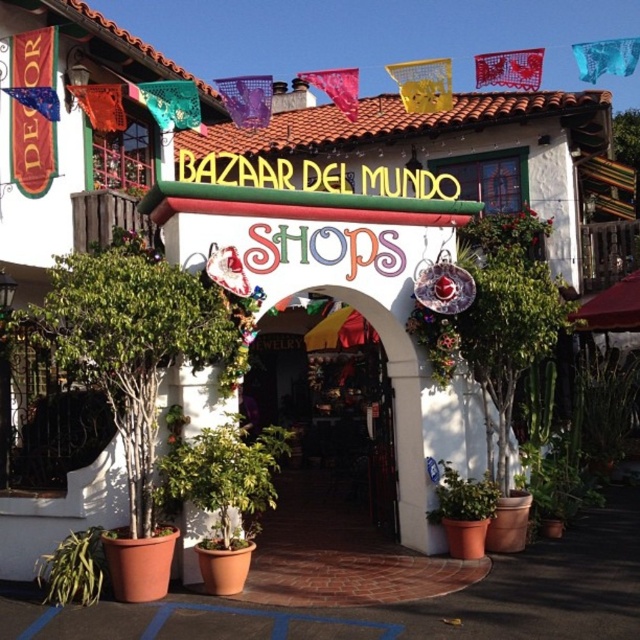
Question: Which point is closer to the camera?

Choices:
 (A) green matte plant at lower center
 (B) wooden door at center
 (C) green leafy plant at center

Answer: (C)

Question: Can you confirm if wooden door at center is smaller than green matte plant at lower center?

Choices:
 (A) no
 (B) yes

Answer: (A)

Question: Can you confirm if green matte plant at lower right is positioned below green matte plant at lower center?

Choices:
 (A) no
 (B) yes

Answer: (B)

Question: Which point is closer to the camera taking this photo?

Choices:
 (A) (456, 508)
 (B) (348, 346)

Answer: (A)

Question: Is green matte plant at lower left below green matte plant at lower center?

Choices:
 (A) yes
 (B) no

Answer: (A)

Question: Which object appears closest to the camera in this image?

Choices:
 (A) green leafy plant at center
 (B) green matte plant at lower left

Answer: (B)